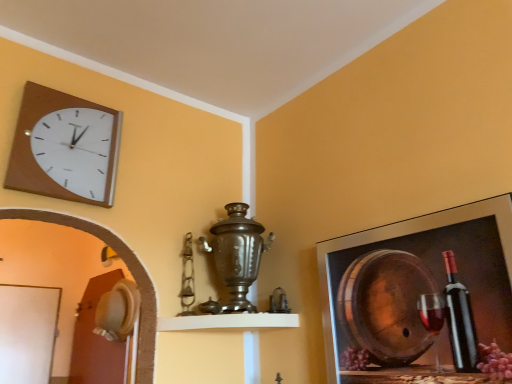
Where is `free region on the left part of matte brown clock at upper left`? This screenshot has height=384, width=512. free region on the left part of matte brown clock at upper left is located at coordinates (29, 210).